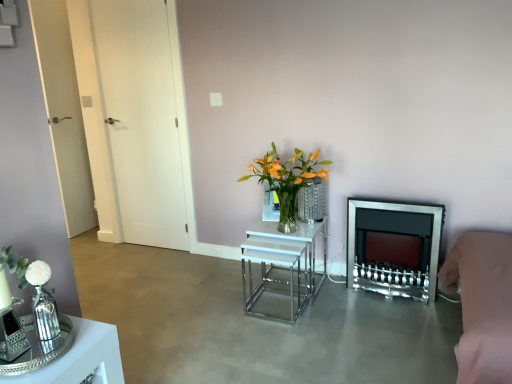
Identify the location of shiny silver fireplace at center right. This screenshot has width=512, height=384. (394, 247).

The width and height of the screenshot is (512, 384). In order to click on pink fabric couch at lower right in this screenshot , I will do `click(482, 305)`.

Find the location of a particular element. This screenshot has height=384, width=512. white glossy door at left is located at coordinates (141, 119).

Identify the location of smooth concrete floor at center. The width and height of the screenshot is (512, 384). (253, 324).

Find the location of `clear glass vase at center`. clear glass vase at center is located at coordinates (311, 201).

Is translucent glass vase at center positioned with its back to white glossy nesting tables at center, placed as the 2th table when sorted from left to right?

translucent glass vase at center does not have its back to white glossy nesting tables at center, placed as the 2th table when sorted from left to right.

Which of these two, translucent glass vase at center or white glossy nesting tables at center, the 2th table positioned from the front, is thinner?

With smaller width is translucent glass vase at center.

From the image's perspective, is translucent glass vase at center above or below white glossy nesting tables at center, the 2th table positioned from the front?

Based on their image positions, translucent glass vase at center is located above white glossy nesting tables at center, the 2th table positioned from the front.

Is translucent glass vase at center outside of white glossy nesting tables at center, the 2th table positioned from the front?

Yes, translucent glass vase at center is located beyond the bounds of white glossy nesting tables at center, the 2th table positioned from the front.

Measure the distance between shiny silver fireplace at center right and clear glass vase at center.

They are 17.92 inches apart.

Who is smaller, shiny silver fireplace at center right or clear glass vase at center?

clear glass vase at center is smaller.

From a real-world perspective, is shiny silver fireplace at center right physically below clear glass vase at center?

Yes.

Which object is closer to the camera taking this photo, shiny silver fireplace at center right or clear glass vase at center?

shiny silver fireplace at center right.

Based on their positions, is white matte square at upper center located to the left or right of shiny silver fireplace at center right?

Based on their positions, white matte square at upper center is located to the left of shiny silver fireplace at center right.

Consider the image. From a real-world perspective, which is physically below, white matte square at upper center or shiny silver fireplace at center right?

shiny silver fireplace at center right, from a real-world perspective.

From the image's perspective, is white matte square at upper center on shiny silver fireplace at center right?

Yes, from the image's perspective, white matte square at upper center is on top of shiny silver fireplace at center right.

Between point (219, 105) and point (410, 251), which one is positioned in front?

The point (410, 251) is closer.

Considering the sizes of objects clear glass vase at center and translucent glass vase at center in the image provided, who is shorter, clear glass vase at center or translucent glass vase at center?

Standing shorter between the two is clear glass vase at center.

Measure the distance between clear glass vase at center and translucent glass vase at center.

clear glass vase at center and translucent glass vase at center are 6.14 inches apart.

Which of these two, clear glass vase at center or translucent glass vase at center, is smaller?

clear glass vase at center.

Where is `vase on the right of translucent glass vase at center`? This screenshot has height=384, width=512. vase on the right of translucent glass vase at center is located at coordinates (311, 201).

From the image's perspective, relative to smooth concrete floor at center, is clear glass vase at center above or below?

Based on their image positions, clear glass vase at center is located above smooth concrete floor at center.

Could you tell me if clear glass vase at center is facing smooth concrete floor at center?

No.

Which is behind, point (316, 195) or point (336, 364)?

Positioned behind is point (316, 195).

Considering their positions, is clear glass vase at center located in front of or behind smooth concrete floor at center?

clear glass vase at center is positioned farther from the viewer than smooth concrete floor at center.

Is shiny silver fireplace at center right facing towards translucent glass vase at center?

No, shiny silver fireplace at center right is not oriented towards translucent glass vase at center.

Is shiny silver fireplace at center right not within translucent glass vase at center?

Yes, shiny silver fireplace at center right is outside of translucent glass vase at center.

Which is more to the right, shiny silver fireplace at center right or translucent glass vase at center?

From the viewer's perspective, shiny silver fireplace at center right appears more on the right side.

Identify the location of floral arrangement in front of the shiny silver fireplace at center right. (287, 180).

Between white matte square at upper center and pink fabric couch at lower right, which one appears on the right side from the viewer's perspective?

pink fabric couch at lower right.

Is white matte square at upper center positioned in front of pink fabric couch at lower right?

No, it is not.

Is white matte square at upper center oriented away from pink fabric couch at lower right?

That's not correct — white matte square at upper center is not looking away from pink fabric couch at lower right.

From a real-world perspective, is white matte square at upper center positioned under pink fabric couch at lower right based on gravity?

No, from a real-world perspective, white matte square at upper center is not under pink fabric couch at lower right.

I want to click on floral arrangement above the white glossy nesting tables at center, placed as the 1th table when sorted from right to left (from the image's perspective), so click(x=287, y=180).

This screenshot has height=384, width=512. What are the coordinates of `vase located behind the shiny silver fireplace at center right` in the screenshot? It's located at click(311, 201).

Which object lies nearer to the anchor point translucent glass vase at center, white matte square at upper center or pink fabric couch at lower right?

Among the two, white matte square at upper center is located nearer to translucent glass vase at center.

Which object lies nearer to the anchor point shiny silver tray at lower left, the second table in the back-to-front sequence, smooth concrete floor at center or shiny silver fireplace at center right?

smooth concrete floor at center is positioned closer to the anchor shiny silver tray at lower left, the second table in the back-to-front sequence.

When comparing their distances from white glossy nesting tables at center, the first table viewed from the back, does translucent glass vase at center or smooth concrete floor at center seem further?

smooth concrete floor at center.

Which object lies nearer to the anchor point white glossy nesting tables at center, the first table viewed from the back, smooth concrete floor at center or white glossy door at left?

smooth concrete floor at center is positioned closer to the anchor white glossy nesting tables at center, the first table viewed from the back.

From the picture: Considering their positions, is smooth concrete floor at center positioned closer to shiny silver fireplace at center right than shiny silver tray at lower left, which ranks as the 1th table in left-to-right order?

The object closer to shiny silver fireplace at center right is smooth concrete floor at center.

Based on their spatial positions, is clear glass vase at center or white matte square at upper center further from white glossy nesting tables at center, the first table viewed from the back?

white matte square at upper center is positioned further to the anchor white glossy nesting tables at center, the first table viewed from the back.

Which object lies nearer to the anchor point pink fabric couch at lower right, smooth concrete floor at center or shiny silver tray at lower left, which ranks as the 1th table in left-to-right order?

smooth concrete floor at center is positioned closer to the anchor pink fabric couch at lower right.

Considering their positions, is shiny silver fireplace at center right positioned further to white glossy nesting tables at center, the first table viewed from the back, than white matte square at upper center?

Based on the image, white matte square at upper center appears to be further to white glossy nesting tables at center, the first table viewed from the back.

In order to click on square between white glossy door at left and clear glass vase at center from left to right in this screenshot , I will do `click(216, 99)`.

The height and width of the screenshot is (384, 512). Find the location of `table between shiny silver tray at lower left, the second table from the right, and shiny silver fireplace at center right`. table between shiny silver tray at lower left, the second table from the right, and shiny silver fireplace at center right is located at coordinates (298, 240).

Where is `floral arrangement between white matte square at upper center and white glossy nesting tables at center, the 2th table positioned from the front, vertically`? The height and width of the screenshot is (384, 512). floral arrangement between white matte square at upper center and white glossy nesting tables at center, the 2th table positioned from the front, vertically is located at coordinates (287, 180).

Identify the location of vase located between white glossy door at left and pink fabric couch at lower right in the left-right direction. (311, 201).